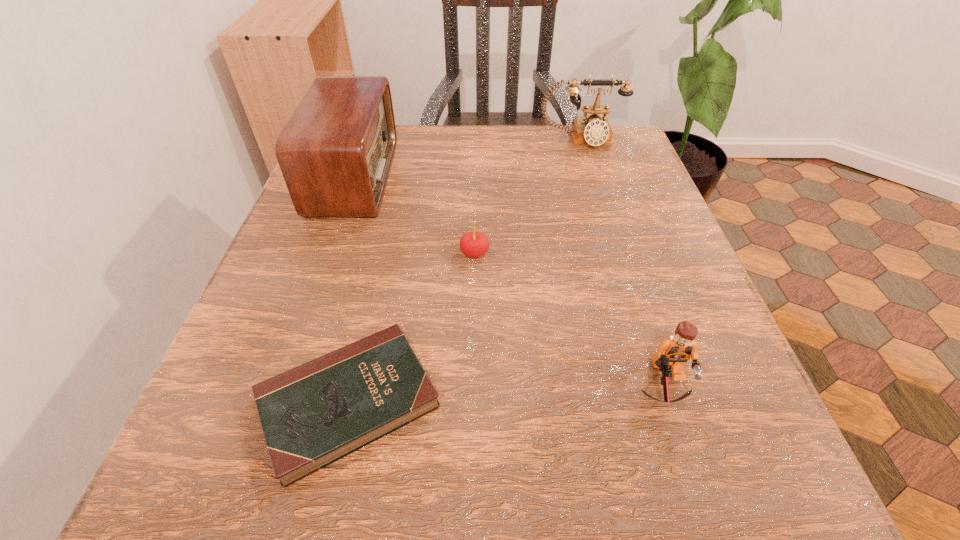
This screenshot has height=540, width=960. Find the location of `free point located 0.370m on the back of the shortest object`. free point located 0.370m on the back of the shortest object is located at coordinates (396, 190).

The width and height of the screenshot is (960, 540). I want to click on radio receiver present at the far edge, so click(335, 152).

Identify the location of telephone that is at the far edge. (594, 130).

The height and width of the screenshot is (540, 960). I want to click on object at the near edge, so click(x=313, y=415).

Where is `radio receiver that is at the left edge`? This screenshot has width=960, height=540. radio receiver that is at the left edge is located at coordinates click(335, 152).

Find the location of `Bible located at the left edge`. Bible located at the left edge is located at coordinates (313, 415).

Find the location of `telephone that is at the right edge`. telephone that is at the right edge is located at coordinates (594, 130).

Find the location of a particular element. This screenshot has width=960, height=540. Lego that is at the right edge is located at coordinates (673, 353).

Identify the location of object that is at the far left corner. The image size is (960, 540). (335, 152).

Locate an element on the screen. The height and width of the screenshot is (540, 960). object that is at the near left corner is located at coordinates (313, 415).